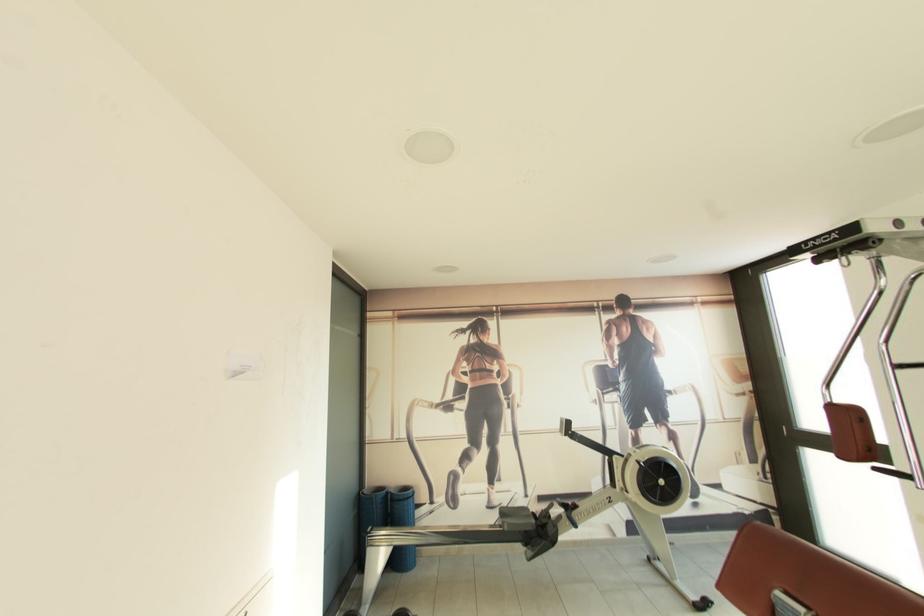
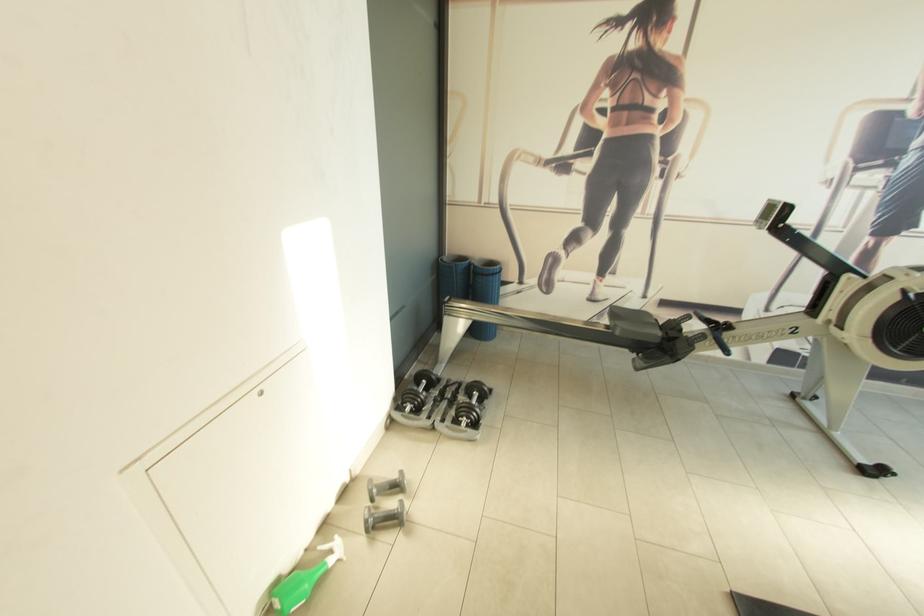
Where in the second image is the point corresponding to (x=410, y=490) from the first image?

(497, 265)